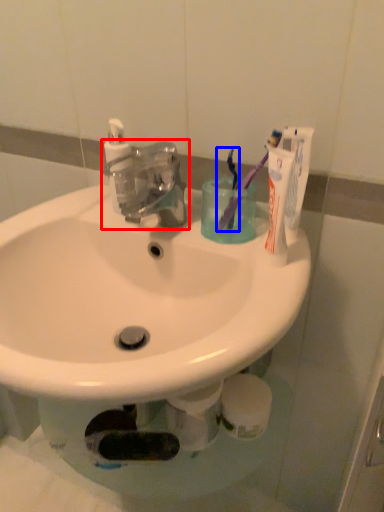
Question: Which object is closer to the camera taking this photo, tap (highlighted by a red box) or toothbrush (highlighted by a blue box)?

Choices:
 (A) tap
 (B) toothbrush

Answer: (A)